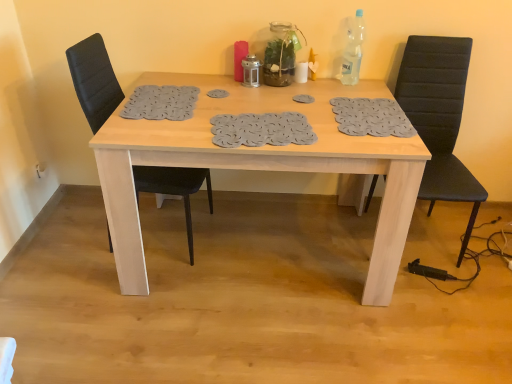
Question: Does light wood table at center appear on the left side of black leather chair at left, the second chair from the right?

Choices:
 (A) no
 (B) yes

Answer: (A)

Question: Could you tell me if light wood table at center is facing black leather chair at left, positioned as the 1th chair in left-to-right order?

Choices:
 (A) no
 (B) yes

Answer: (A)

Question: From the image's perspective, is light wood table at center above black leather chair at left, the second chair from the right?

Choices:
 (A) no
 (B) yes

Answer: (A)

Question: Is light wood table at center not near black leather chair at left, the second chair from the right?

Choices:
 (A) no
 (B) yes

Answer: (A)

Question: Can you confirm if light wood table at center is thinner than black leather chair at left, positioned as the 1th chair in left-to-right order?

Choices:
 (A) no
 (B) yes

Answer: (A)

Question: Based on their sizes in the image, would you say black leather chair at right, arranged as the 2th chair when viewed from the left, is bigger or smaller than black leather chair at left, positioned as the 1th chair in left-to-right order?

Choices:
 (A) small
 (B) big

Answer: (B)

Question: From a real-world perspective, is black leather chair at right, which is counted as the first chair, starting from the right, physically located above or below black leather chair at left, the second chair from the right?

Choices:
 (A) below
 (B) above

Answer: (A)

Question: Considering the positions of black leather chair at right, arranged as the 2th chair when viewed from the left, and black leather chair at left, positioned as the 1th chair in left-to-right order, in the image, is black leather chair at right, arranged as the 2th chair when viewed from the left, taller or shorter than black leather chair at left, positioned as the 1th chair in left-to-right order,?

Choices:
 (A) tall
 (B) short

Answer: (B)

Question: From the image's perspective, is black leather chair at right, which is counted as the first chair, starting from the right, positioned above or below black leather chair at left, the second chair from the right?

Choices:
 (A) above
 (B) below

Answer: (B)

Question: From the image's perspective, is light wood table at center positioned above or below black leather chair at left, the second chair from the right?

Choices:
 (A) above
 (B) below

Answer: (B)

Question: From a real-world perspective, relative to black leather chair at left, the second chair from the right, is light wood table at center vertically above or below?

Choices:
 (A) above
 (B) below

Answer: (B)

Question: In terms of width, does light wood table at center look wider or thinner when compared to black leather chair at left, positioned as the 1th chair in left-to-right order?

Choices:
 (A) thin
 (B) wide

Answer: (B)

Question: In the image, is light wood table at center positioned in front of or behind black leather chair at left, the second chair from the right?

Choices:
 (A) behind
 (B) front

Answer: (B)

Question: Is black leather chair at left, positioned as the 1th chair in left-to-right order, spatially inside black leather chair at right, which is counted as the first chair, starting from the right, or outside of it?

Choices:
 (A) outside
 (B) inside

Answer: (A)

Question: From a real-world perspective, is black leather chair at left, the second chair from the right, physically located above or below black leather chair at right, arranged as the 2th chair when viewed from the left?

Choices:
 (A) below
 (B) above

Answer: (B)